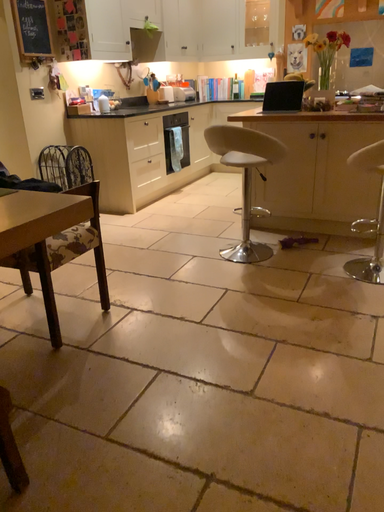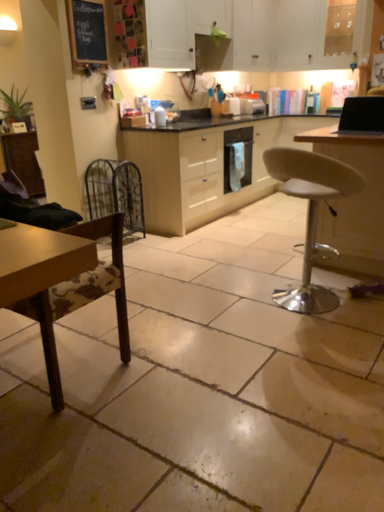
Question: How did the camera likely rotate when shooting the video?

Choices:
 (A) rotated left
 (B) rotated right

Answer: (A)